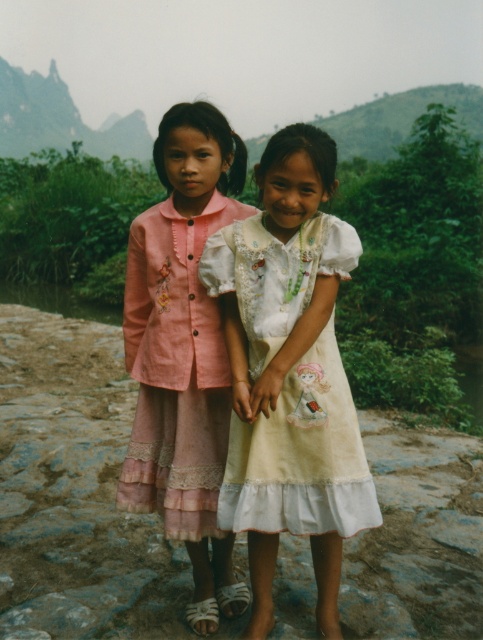
Is white cotton dress at center thinner than pink lace dress at center?

Incorrect, white cotton dress at center's width is not less than pink lace dress at center's.

Is point (298, 358) farther from viewer compared to point (187, 342)?

No, (298, 358) is in front of (187, 342).

Find the location of a particular element. This screenshot has width=483, height=640. white cotton dress at center is located at coordinates (x=300, y=456).